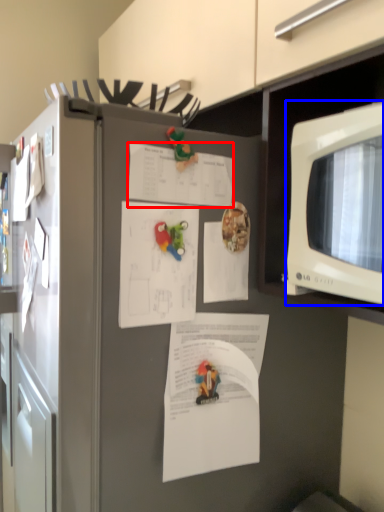
Question: Which of the following is the farthest to the observer, document (highlighted by a red box) or microwave oven (highlighted by a blue box)?

Choices:
 (A) document
 (B) microwave oven

Answer: (A)